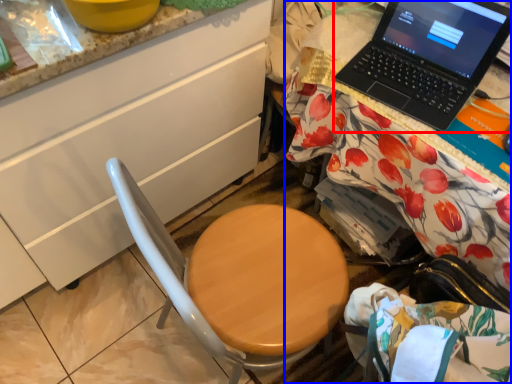
Question: Which object appears farthest to the camera in this image, laptop (highlighted by a red box) or desk (highlighted by a blue box)?

Choices:
 (A) laptop
 (B) desk

Answer: (A)